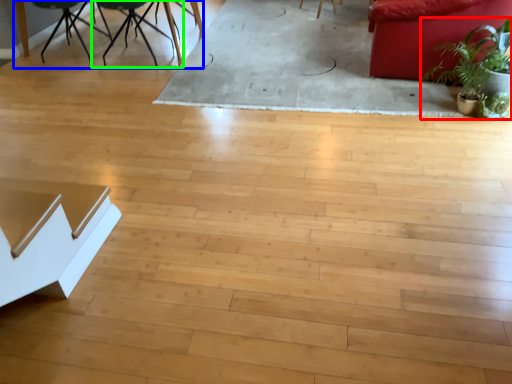
Question: Which object is positioned closest to houseplant (highlighted by a red box)? Select from round table (highlighted by a blue box) and chair (highlighted by a green box).

Choices:
 (A) round table
 (B) chair

Answer: (B)